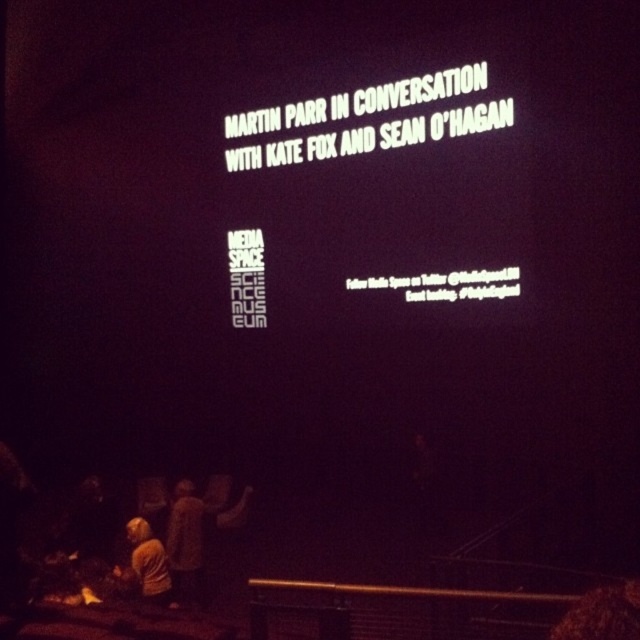
Question: Which point appears closest to the camera in this image?

Choices:
 (A) (506, 218)
 (B) (156, 561)
 (C) (179, 550)

Answer: (B)

Question: Is white text on black screen at center bigger than dark brown fabric at lower left?

Choices:
 (A) no
 (B) yes

Answer: (B)

Question: Which object is the farthest from the yellow fabric at lower left?

Choices:
 (A) dark brown fabric at lower left
 (B) white text on black screen at center

Answer: (B)

Question: Which point is closer to the camera?

Choices:
 (A) (154, 596)
 (B) (432, 157)
 (C) (195, 547)

Answer: (A)

Question: Is dark brown fabric at lower left wider than yellow fabric at lower left?

Choices:
 (A) yes
 (B) no

Answer: (B)

Question: Can you confirm if white text on black screen at center is positioned below yellow fabric at lower left?

Choices:
 (A) yes
 (B) no

Answer: (B)